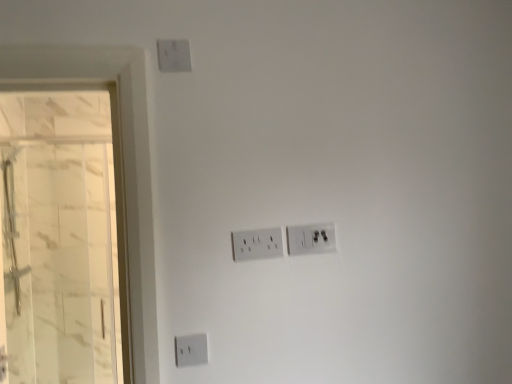
You are a GUI agent. You are given a task and a screenshot of the screen. Output one action in this format:
    pyautogui.click(x=<x>, y=<y>)
    Task: Click on the white marble glass door at left
    
    Given the screenshot: What is the action you would take?
    pyautogui.click(x=63, y=238)

Describe the element at coordinates (63, 238) in the screenshot. The width and height of the screenshot is (512, 384). I see `white marble glass door at left` at that location.

The width and height of the screenshot is (512, 384). Find the location of `white plastic power plugs and sockets at center, marked as the 1th power plugs and sockets in a right-to-left arrangement`. white plastic power plugs and sockets at center, marked as the 1th power plugs and sockets in a right-to-left arrangement is located at coordinates (310, 239).

Does white marble glass door at left turn towards white plastic power plugs and sockets at center, placed as the second power plugs and sockets when sorted from left to right?

No, white marble glass door at left does not turn towards white plastic power plugs and sockets at center, placed as the second power plugs and sockets when sorted from left to right.

From a real-world perspective, which object stands above the other?

white plastic power plugs and sockets at center, marked as the 1th power plugs and sockets in a right-to-left arrangement.

From the picture: From the image's perspective, is white marble glass door at left located above white plastic power plugs and sockets at center, marked as the 1th power plugs and sockets in a right-to-left arrangement?

No, from the image's perspective, white marble glass door at left is not on top of white plastic power plugs and sockets at center, marked as the 1th power plugs and sockets in a right-to-left arrangement.

Would you say white plastic power plugs and sockets at center, placed as the second power plugs and sockets when sorted from left to right, is part of white marble glass door at left's contents?

That's incorrect, white plastic power plugs and sockets at center, placed as the second power plugs and sockets when sorted from left to right, is not inside white marble glass door at left.

Is white plastic power plugs and sockets at center, marked as the 1th power plugs and sockets in a right-to-left arrangement, taller or shorter than white plastic power plugs and sockets at center, which is the 2th power plugs and sockets in right-to-left order?

Clearly, white plastic power plugs and sockets at center, marked as the 1th power plugs and sockets in a right-to-left arrangement, is taller compared to white plastic power plugs and sockets at center, which is the 2th power plugs and sockets in right-to-left order.

Is white plastic power plugs and sockets at center, placed as the second power plugs and sockets when sorted from left to right, outside of white plastic power plugs and sockets at center, the 1th power plugs and sockets viewed from the left?

That's correct, white plastic power plugs and sockets at center, placed as the second power plugs and sockets when sorted from left to right, is outside of white plastic power plugs and sockets at center, the 1th power plugs and sockets viewed from the left.

Could you tell me if white plastic power plugs and sockets at center, marked as the 1th power plugs and sockets in a right-to-left arrangement, is facing white plastic power plugs and sockets at center, which is the 2th power plugs and sockets in right-to-left order?

No.

Which is nearer, [307,248] or [277,246]?

Point [307,248] is farther from the camera than point [277,246].

Considering the positions of points (263, 238) and (306, 240), is point (263, 238) closer to camera compared to point (306, 240)?

Yes, point (263, 238) is in front of point (306, 240).

Is there a large distance between white plastic power plugs and sockets at center, which is the 2th power plugs and sockets in right-to-left order, and white plastic power plugs and sockets at center, placed as the second power plugs and sockets when sorted from left to right?

white plastic power plugs and sockets at center, which is the 2th power plugs and sockets in right-to-left order, is actually quite close to white plastic power plugs and sockets at center, placed as the second power plugs and sockets when sorted from left to right.

From the image's perspective, is white plastic power plugs and sockets at center, the 1th power plugs and sockets viewed from the left, above white plastic power plugs and sockets at center, marked as the 1th power plugs and sockets in a right-to-left arrangement?

No, from the image's perspective, white plastic power plugs and sockets at center, the 1th power plugs and sockets viewed from the left, is not above white plastic power plugs and sockets at center, marked as the 1th power plugs and sockets in a right-to-left arrangement.

Based on the photo, in terms of height, does white plastic power plugs and sockets at center, which is the 2th power plugs and sockets in right-to-left order, look taller or shorter compared to white marble glass door at left?

In the image, white plastic power plugs and sockets at center, which is the 2th power plugs and sockets in right-to-left order, appears to be shorter than white marble glass door at left.

At what (x,y) coordinates should I click in order to perform the action: click on glass door directly beneath the white plastic power plugs and sockets at center, the 1th power plugs and sockets viewed from the left (from a real-world perspective). Please return your answer as a coordinate pair (x, y). Looking at the image, I should click on (63, 238).

Would you say white plastic power plugs and sockets at center, which is the 2th power plugs and sockets in right-to-left order, is inside or outside white marble glass door at left?

The correct answer is: outside.

From the image's perspective, between white plastic power plugs and sockets at center, which is the 2th power plugs and sockets in right-to-left order, and white marble glass door at left, who is located below?

white marble glass door at left.

In the scene shown: Looking at their sizes, would you say white plastic power plugs and sockets at center, placed as the second power plugs and sockets when sorted from left to right, is wider or thinner than white marble glass door at left?

Clearly, white plastic power plugs and sockets at center, placed as the second power plugs and sockets when sorted from left to right, has less width compared to white marble glass door at left.

Is white plastic power plugs and sockets at center, marked as the 1th power plugs and sockets in a right-to-left arrangement, not within white marble glass door at left?

white plastic power plugs and sockets at center, marked as the 1th power plugs and sockets in a right-to-left arrangement, lies outside white marble glass door at left's area.

Considering the points (317, 248) and (63, 328), which point is in front, point (317, 248) or point (63, 328)?

The point (317, 248) is in front.

Is white plastic power plugs and sockets at center, marked as the 1th power plugs and sockets in a right-to-left arrangement, next to white marble glass door at left and touching it?

There is a gap between white plastic power plugs and sockets at center, marked as the 1th power plugs and sockets in a right-to-left arrangement, and white marble glass door at left.

Does white marble glass door at left touch white plastic power plugs and sockets at center, which is the 2th power plugs and sockets in right-to-left order?

No, white marble glass door at left is not making contact with white plastic power plugs and sockets at center, which is the 2th power plugs and sockets in right-to-left order.

How different are the orientations of white marble glass door at left and white plastic power plugs and sockets at center, the 1th power plugs and sockets viewed from the left, in degrees?

They differ by 0.531 degrees in their facing directions.

Choose the correct answer: Is white marble glass door at left inside white plastic power plugs and sockets at center, which is the 2th power plugs and sockets in right-to-left order, or outside it?

white marble glass door at left cannot be found inside white plastic power plugs and sockets at center, which is the 2th power plugs and sockets in right-to-left order.

In terms of width, does white marble glass door at left look wider or thinner when compared to white plastic power plugs and sockets at center, the 1th power plugs and sockets viewed from the left?

white marble glass door at left is wider than white plastic power plugs and sockets at center, the 1th power plugs and sockets viewed from the left.

This screenshot has height=384, width=512. In the image, there is a white plastic power plugs and sockets at center, marked as the 1th power plugs and sockets in a right-to-left arrangement. In order to click on glass door below it (from the image's perspective) in this screenshot , I will do `click(63, 238)`.

Find the location of `power plugs and sockets that is behind the white plastic power plugs and sockets at center, the 1th power plugs and sockets viewed from the left`. power plugs and sockets that is behind the white plastic power plugs and sockets at center, the 1th power plugs and sockets viewed from the left is located at coordinates (310, 239).

Estimate the real-world distances between objects in this image. Which object is further from white marble glass door at left, white plastic power plugs and sockets at center, marked as the 1th power plugs and sockets in a right-to-left arrangement, or white plastic power plugs and sockets at center, which is the 2th power plugs and sockets in right-to-left order?

Based on the image, white plastic power plugs and sockets at center, marked as the 1th power plugs and sockets in a right-to-left arrangement, appears to be further to white marble glass door at left.

When comparing their distances from white plastic power plugs and sockets at center, the 1th power plugs and sockets viewed from the left, does white plastic power plugs and sockets at center, placed as the second power plugs and sockets when sorted from left to right, or white marble glass door at left seem closer?

The object closer to white plastic power plugs and sockets at center, the 1th power plugs and sockets viewed from the left, is white plastic power plugs and sockets at center, placed as the second power plugs and sockets when sorted from left to right.

Based on their spatial positions, is white marble glass door at left or white plastic power plugs and sockets at center, marked as the 1th power plugs and sockets in a right-to-left arrangement, closer to white plastic power plugs and sockets at center, the 1th power plugs and sockets viewed from the left?

Based on the image, white plastic power plugs and sockets at center, marked as the 1th power plugs and sockets in a right-to-left arrangement, appears to be nearer to white plastic power plugs and sockets at center, the 1th power plugs and sockets viewed from the left.

When comparing their distances from white marble glass door at left, does white plastic power plugs and sockets at center, which is the 2th power plugs and sockets in right-to-left order, or white plastic power plugs and sockets at center, placed as the second power plugs and sockets when sorted from left to right, seem further?

white plastic power plugs and sockets at center, placed as the second power plugs and sockets when sorted from left to right, lies further to white marble glass door at left than the other object.

Which object lies nearer to the anchor point white plastic power plugs and sockets at center, marked as the 1th power plugs and sockets in a right-to-left arrangement, white marble glass door at left or white plastic power plugs and sockets at center, the 1th power plugs and sockets viewed from the left?

white plastic power plugs and sockets at center, the 1th power plugs and sockets viewed from the left, lies closer to white plastic power plugs and sockets at center, marked as the 1th power plugs and sockets in a right-to-left arrangement, than the other object.

Considering their positions, is white plastic power plugs and sockets at center, which is the 2th power plugs and sockets in right-to-left order, positioned further to white plastic power plugs and sockets at center, placed as the second power plugs and sockets when sorted from left to right, than white marble glass door at left?

Based on the image, white marble glass door at left appears to be further to white plastic power plugs and sockets at center, placed as the second power plugs and sockets when sorted from left to right.

Locate an element on the screen. The height and width of the screenshot is (384, 512). power plugs and sockets located between white marble glass door at left and white plastic power plugs and sockets at center, marked as the 1th power plugs and sockets in a right-to-left arrangement, in the left-right direction is located at coordinates (257, 244).